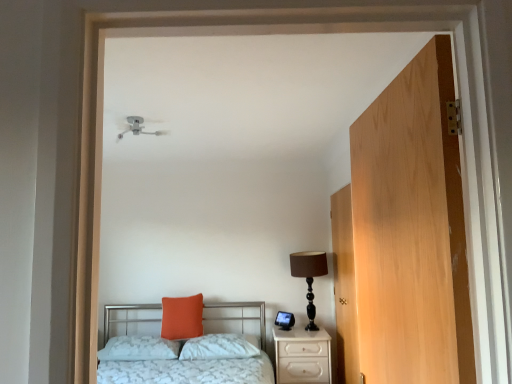
Question: Can you confirm if brown fabric lampshade at right is thinner than light wood door at right, the first door in the front-to-back sequence?

Choices:
 (A) no
 (B) yes

Answer: (A)

Question: Would you say light wood door at right, the first door in the front-to-back sequence, is part of brown fabric lampshade at right's contents?

Choices:
 (A) no
 (B) yes

Answer: (A)

Question: Can you confirm if brown fabric lampshade at right is positioned to the right of light wood door at right, which appears as the 2th door when viewed from the right?

Choices:
 (A) no
 (B) yes

Answer: (B)

Question: Is brown fabric lampshade at right at the left side of light wood door at right, marked as the 1th door in a left-to-right arrangement?

Choices:
 (A) no
 (B) yes

Answer: (A)

Question: Is brown fabric lampshade at right next to light wood door at right, which appears as the 2th door when viewed from the right, and touching it?

Choices:
 (A) yes
 (B) no

Answer: (B)

Question: Is brown fabric lampshade at right shorter than light wood door at right, marked as the 1th door in a left-to-right arrangement?

Choices:
 (A) yes
 (B) no

Answer: (A)

Question: Are orange matte pillow at center, the first pillow when ordered from left to right, and white glossy nightstand at lower right beside each other?

Choices:
 (A) yes
 (B) no

Answer: (B)

Question: From a real-world perspective, is orange matte pillow at center, the 3th pillow viewed from the right, under white glossy nightstand at lower right?

Choices:
 (A) no
 (B) yes

Answer: (A)

Question: Can we say orange matte pillow at center, the first pillow when ordered from left to right, lies outside white glossy nightstand at lower right?

Choices:
 (A) no
 (B) yes

Answer: (B)

Question: Is orange matte pillow at center, the first pillow when ordered from left to right, wider than white glossy nightstand at lower right?

Choices:
 (A) yes
 (B) no

Answer: (B)

Question: Is orange matte pillow at center, the 3th pillow viewed from the right, smaller than white glossy nightstand at lower right?

Choices:
 (A) no
 (B) yes

Answer: (B)

Question: From the image's perspective, is orange matte pillow at center, the first pillow when ordered from left to right, under white glossy nightstand at lower right?

Choices:
 (A) yes
 (B) no

Answer: (B)

Question: Considering the relative sizes of orange matte pillow at center, the first pillow when ordered from left to right, and light brown wood door at right, the 1th door positioned from the back, in the image provided, is orange matte pillow at center, the first pillow when ordered from left to right, bigger than light brown wood door at right, the 1th door positioned from the back,?

Choices:
 (A) no
 (B) yes

Answer: (A)